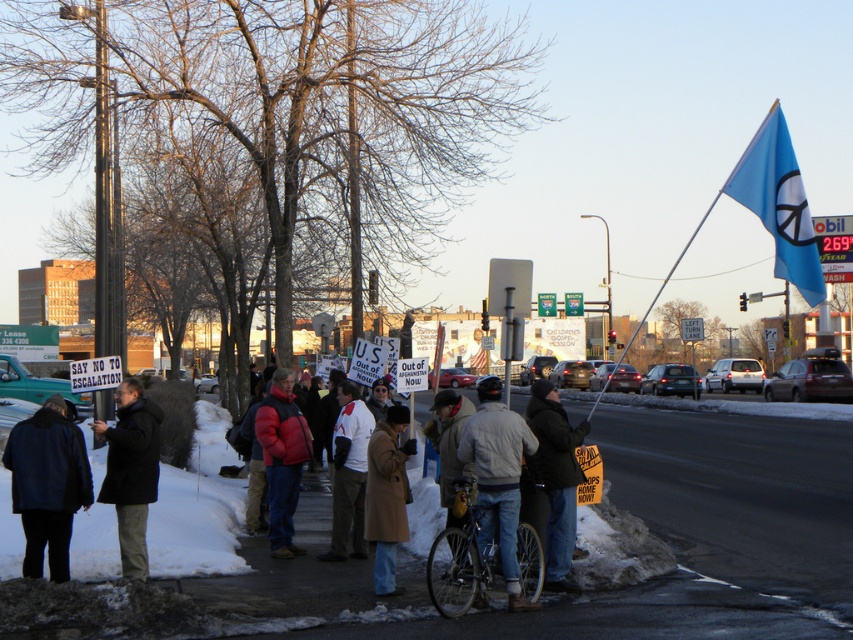
Is denim jacket at center to the right of brown wool coat at center from the viewer's perspective?

Indeed, denim jacket at center is positioned on the right side of brown wool coat at center.

Is denim jacket at center taller than brown wool coat at center?

Indeed, denim jacket at center has a greater height compared to brown wool coat at center.

Is point (503, 513) in front of point (380, 454)?

Yes.

The height and width of the screenshot is (640, 853). I want to click on denim jacket at center, so click(498, 477).

Looking at this image, can you confirm if metallic silver bicycle at center is smaller than black leather jacket at center?

Incorrect, metallic silver bicycle at center is not smaller in size than black leather jacket at center.

Which is in front, point (518, 531) or point (550, 547)?

Positioned in front is point (518, 531).

Does point (444, 586) come in front of point (572, 465)?

Yes, point (444, 586) is closer to viewer.

At what (x,y) coordinates should I click in order to perform the action: click on metallic silver bicycle at center. Please return your answer as a coordinate pair (x, y). The image size is (853, 640). Looking at the image, I should click on (460, 560).

Is point (546, 387) closer to viewer compared to point (271, 541)?

Yes, point (546, 387) is closer to viewer.

Between point (552, 552) and point (271, 556), which one is positioned in front?

Point (552, 552) is more forward.

Where is `black leather jacket at center`? The image size is (853, 640). black leather jacket at center is located at coordinates (555, 477).